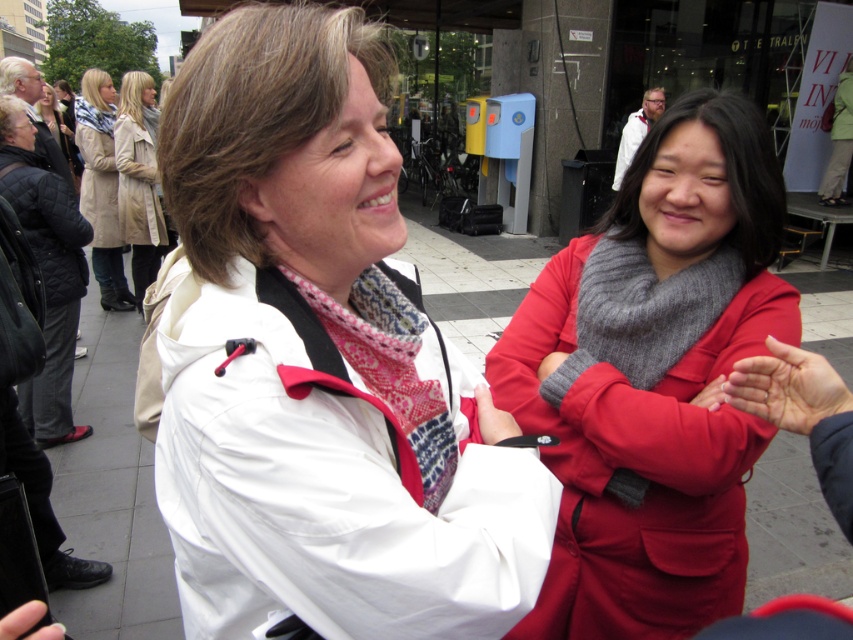
Question: Does patterned fabric scarf at center appear under matte red glove at center?

Choices:
 (A) no
 (B) yes

Answer: (A)

Question: From the image, what is the correct spatial relationship of patterned fabric scarf at center in relation to beige leather coat at upper left?

Choices:
 (A) left
 (B) right

Answer: (B)

Question: Which object is closer to the camera taking this photo?

Choices:
 (A) matte red glove at center
 (B) gray knitted scarf at center
 (C) white matte jacket at center
 (D) gray woolen scarf at upper right

Answer: (C)

Question: Can you confirm if smooth skin hand at center is positioned below gray woolen scarf at upper right?

Choices:
 (A) no
 (B) yes

Answer: (A)

Question: Among these objects, which one is farthest from the camera?

Choices:
 (A) gray woolen scarf at upper right
 (B) beige leather coat at upper left
 (C) smooth skin hand at center
 (D) patterned fabric scarf at center

Answer: (B)

Question: Which of the following is the closest to the observer?

Choices:
 (A) (506, 428)
 (B) (149, 141)

Answer: (A)